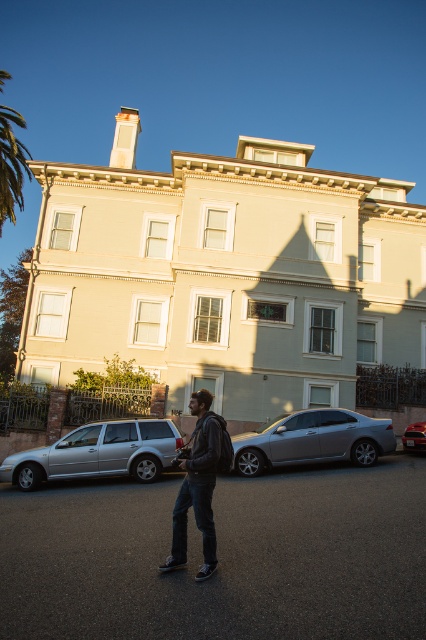
Question: Estimate the real-world distances between objects in this image. Which object is farther from the silver metallic station wagon at lower left?

Choices:
 (A) metallic silver sedan at center
 (B) green leafy palm tree at upper left
 (C) satin silver sedan at center

Answer: (B)

Question: Does silver metallic station wagon at lower left have a greater width compared to green leafy palm tree at upper left?

Choices:
 (A) no
 (B) yes

Answer: (A)

Question: Does green leafy palm tree at upper left appear on the left side of metallic silver sedan at center?

Choices:
 (A) yes
 (B) no

Answer: (A)

Question: Does dark gray hoodie at center appear under metallic silver sedan at center?

Choices:
 (A) no
 (B) yes

Answer: (A)

Question: Estimate the real-world distances between objects in this image. Which object is closer to the green leafy palm tree at upper left?

Choices:
 (A) metallic silver sedan at center
 (B) satin silver sedan at center
 (C) silver metallic station wagon at lower left

Answer: (C)

Question: Which of the following is the closest to the observer?

Choices:
 (A) metallic silver sedan at center
 (B) silver metallic station wagon at lower left
 (C) dark gray hoodie at center

Answer: (C)